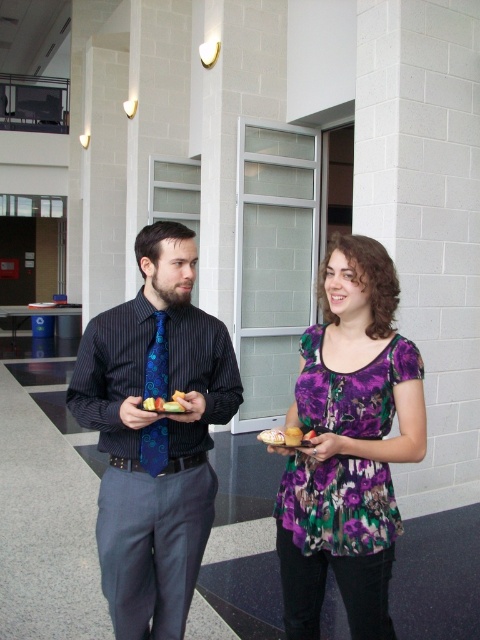
Question: Among these points, which one is nearest to the camera?

Choices:
 (A) (96, 371)
 (B) (176, 404)

Answer: (B)

Question: Is smooth yellow cake at center above smooth white bread at center?

Choices:
 (A) no
 (B) yes

Answer: (B)

Question: Is the position of purple floral dress at center more distant than that of blue silk tie at center?

Choices:
 (A) yes
 (B) no

Answer: (B)

Question: Which object is farther from the camera taking this photo?

Choices:
 (A) golden bread at center
 (B) blue patterned tie at center

Answer: (B)

Question: Which of the following is the farthest from the observer?

Choices:
 (A) (159, 314)
 (B) (373, 435)

Answer: (A)

Question: In this image, where is blue patterned tie at center located relative to purple floral dress at center?

Choices:
 (A) below
 (B) above

Answer: (B)